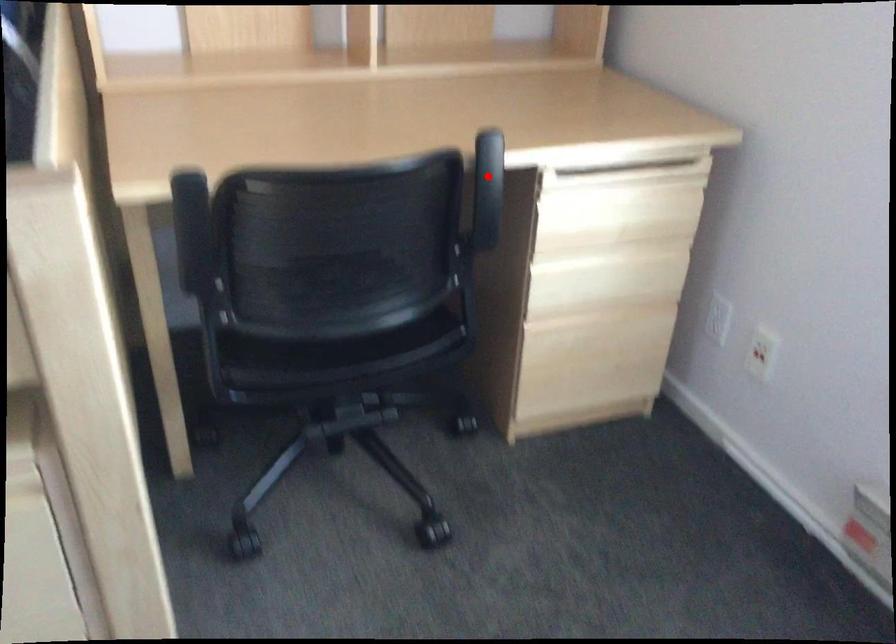
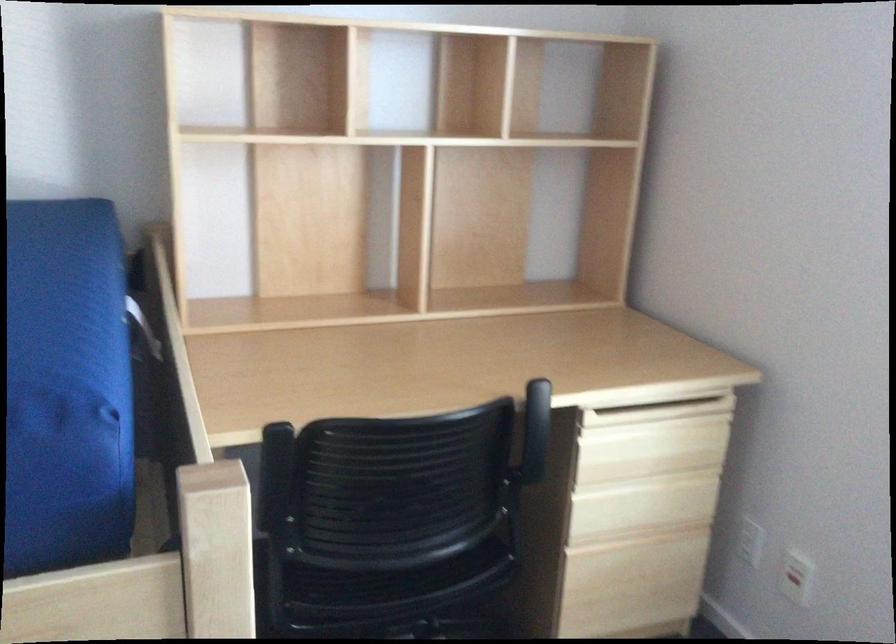
Find the pixel in the second image that matches the highlighted location in the first image.

(536, 417)